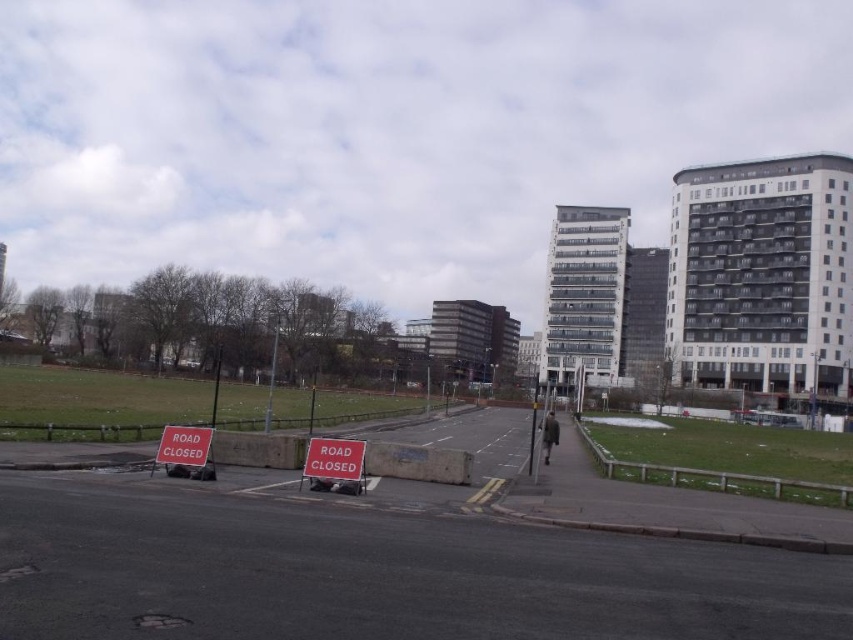
Question: Among these objects, which one is farthest from the camera?

Choices:
 (A) red plastic sign at center
 (B) red plastic sign at lower left

Answer: (B)

Question: Is red plastic sign at center above red plastic sign at lower left?

Choices:
 (A) yes
 (B) no

Answer: (A)

Question: Which point appears farthest from the camera in this image?

Choices:
 (A) (360, 456)
 (B) (166, 435)

Answer: (B)

Question: Which point appears farthest from the camera in this image?

Choices:
 (A) (338, 461)
 (B) (189, 442)

Answer: (B)

Question: Is red plastic sign at center behind red plastic sign at lower left?

Choices:
 (A) no
 (B) yes

Answer: (A)

Question: Is red plastic sign at center bigger than red plastic sign at lower left?

Choices:
 (A) yes
 (B) no

Answer: (B)